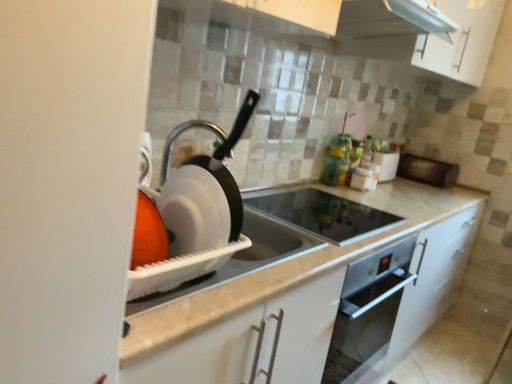
How much space does white plastic dish rack at left, which appears as the 1th appliance when viewed from the left, occupy horizontally?

white plastic dish rack at left, which appears as the 1th appliance when viewed from the left, is 4.08 inches in width.

What is the approximate height of black matte microwave at right, which ranks as the fourth appliance in front-to-back order?

black matte microwave at right, which ranks as the fourth appliance in front-to-back order, is 5.98 inches tall.

How much space does white glossy toaster at upper right, which ranks as the 3th appliance in front-to-back order, occupy horizontally?

It is 5.95 inches.

This screenshot has width=512, height=384. What do you see at coordinates (322, 213) in the screenshot? I see `black glass cooktop at center, the second appliance when ordered from left to right` at bounding box center [322, 213].

Where is `white glossy exhaust hood at upper center`? This screenshot has height=384, width=512. white glossy exhaust hood at upper center is located at coordinates (387, 27).

The height and width of the screenshot is (384, 512). What are the coordinates of `white plastic dish rack at left, which is the 4th appliance from right to left` in the screenshot? It's located at (197, 216).

From the image's perspective, is white glossy toaster at upper right, which ranks as the 3th appliance in front-to-back order, on white plastic dish rack at left, which is the 1th appliance in front-to-back order?

Yes, from the image's perspective, white glossy toaster at upper right, which ranks as the 3th appliance in front-to-back order, is on top of white plastic dish rack at left, which is the 1th appliance in front-to-back order.

Can you confirm if white glossy toaster at upper right, the 3th appliance in the left-to-right sequence, is smaller than white plastic dish rack at left, which appears as the 1th appliance when viewed from the left?

Correct, white glossy toaster at upper right, the 3th appliance in the left-to-right sequence, occupies less space than white plastic dish rack at left, which appears as the 1th appliance when viewed from the left.

Can you tell me how much white glossy toaster at upper right, the second appliance when ordered from right to left, and white plastic dish rack at left, the fourth appliance when ordered from back to front, differ in facing direction?

white glossy toaster at upper right, the second appliance when ordered from right to left, and white plastic dish rack at left, the fourth appliance when ordered from back to front, are facing 95.2 degrees away from each other.

From the image's perspective, would you say white marble countertop at center is positioned over black matte microwave at right, placed as the 4th appliance when sorted from left to right?

No.

From a real-world perspective, is white marble countertop at center on top of black matte microwave at right, positioned as the 1th appliance in right-to-left order?

No.

Based on their sizes in the image, would you say white marble countertop at center is bigger or smaller than black matte microwave at right, which ranks as the fourth appliance in front-to-back order?

white marble countertop at center is bigger than black matte microwave at right, which ranks as the fourth appliance in front-to-back order.

Looking at this image, can you confirm if white marble countertop at center is taller than black matte microwave at right, which ranks as the fourth appliance in front-to-back order?

Correct, white marble countertop at center is much taller as black matte microwave at right, which ranks as the fourth appliance in front-to-back order.

What's the angular difference between black matte microwave at right, positioned as the 1th appliance in right-to-left order, and white marble countertop at center's facing directions?

90.9 degrees.

Does point (448, 167) come farther from viewer compared to point (311, 278)?

Yes.

Is white marble countertop at center at the back of black matte microwave at right, which ranks as the fourth appliance in front-to-back order?

That's not correct — black matte microwave at right, which ranks as the fourth appliance in front-to-back order, is not looking away from white marble countertop at center.

Relative to white marble countertop at center, is black matte microwave at right, the 1th appliance from the back, in front or behind?

black matte microwave at right, the 1th appliance from the back, is positioned farther from the viewer than white marble countertop at center.

Between white marble countertop at center and white glossy toaster at upper right, the 2th appliance viewed from the back, which one has more height?

white marble countertop at center.

Based on their positions, is white marble countertop at center located to the left or right of white glossy toaster at upper right, which ranks as the 3th appliance in front-to-back order?

Based on their positions, white marble countertop at center is located to the left of white glossy toaster at upper right, which ranks as the 3th appliance in front-to-back order.

Which point is more forward, (302,361) or (387,170)?

Positioned in front is point (302,361).

Looking at this image, can you confirm if white marble countertop at center is wider than white glossy toaster at upper right, the 3th appliance in the left-to-right sequence?

Indeed, white marble countertop at center has a greater width compared to white glossy toaster at upper right, the 3th appliance in the left-to-right sequence.

Are white glossy toaster at upper right, the second appliance when ordered from right to left, and black matte microwave at right, which ranks as the fourth appliance in front-to-back order, making contact?

No, white glossy toaster at upper right, the second appliance when ordered from right to left, is not next to black matte microwave at right, which ranks as the fourth appliance in front-to-back order.

Based on the photo, could you measure the distance between white glossy toaster at upper right, the 2th appliance viewed from the back, and black matte microwave at right, which ranks as the fourth appliance in front-to-back order?

13.44 inches.

Which is behind, point (376, 154) or point (416, 164)?

Point (416, 164)

In the scene shown: From the image's perspective, which is below, white glossy toaster at upper right, the 2th appliance viewed from the back, or black matte microwave at right, the 1th appliance from the back?

From the image's view, black matte microwave at right, the 1th appliance from the back, is below.

Considering the sizes of objects black glass cooktop at center, which appears as the 3th appliance when viewed from the back, and white marble countertop at center in the image provided, who is taller, black glass cooktop at center, which appears as the 3th appliance when viewed from the back, or white marble countertop at center?

With more height is white marble countertop at center.

Would you say black glass cooktop at center, the second appliance from the front, is to the left or to the right of white marble countertop at center in the picture?

black glass cooktop at center, the second appliance from the front, is positioned on white marble countertop at center's left side.

From a real-world perspective, is black glass cooktop at center, the second appliance from the front, above or below white marble countertop at center?

From a real-world perspective, black glass cooktop at center, the second appliance from the front, is physically above white marble countertop at center.

Is black glass cooktop at center, the second appliance from the front, turned away from white marble countertop at center?

Correct, black glass cooktop at center, the second appliance from the front, is looking away from white marble countertop at center.

Is white plastic dish rack at left, which is the 4th appliance from right to left, at the back of black matte microwave at right, which ranks as the fourth appliance in front-to-back order?

No, black matte microwave at right, which ranks as the fourth appliance in front-to-back order, is not facing the opposite direction of white plastic dish rack at left, which is the 4th appliance from right to left.

This screenshot has height=384, width=512. There is a black matte microwave at right, placed as the 4th appliance when sorted from left to right. What are the coordinates of `the 2nd appliance above it (from a real-world perspective)` in the screenshot? It's located at (197, 216).

What's the angular difference between black matte microwave at right, positioned as the 1th appliance in right-to-left order, and white plastic dish rack at left, the fourth appliance when ordered from back to front,'s facing directions?

The angular difference between black matte microwave at right, positioned as the 1th appliance in right-to-left order, and white plastic dish rack at left, the fourth appliance when ordered from back to front, is 175 degrees.

Starting from the white plastic dish rack at left, which is the 4th appliance from right to left, which appliance is the 2nd one to the right? Please provide its 2D coordinates.

[(386, 164)]

Find the location of a particular element. the 4th appliance behind when counting from the white marble countertop at center is located at coordinates (426, 170).

Considering their positions, is black matte microwave at right, the 1th appliance from the back, positioned further to white marble countertop at center than black glass cooktop at center, which appears as the 3th appliance when viewed from the back?

black matte microwave at right, the 1th appliance from the back, is positioned further to the anchor white marble countertop at center.

Based on the photo, looking at the image, which one is located closer to white glossy exhaust hood at upper center, white marble countertop at center or white plastic dish rack at left, which is the 4th appliance from right to left?

white plastic dish rack at left, which is the 4th appliance from right to left.

In the scene shown: Estimate the real-world distances between objects in this image. Which object is closer to white glossy toaster at upper right, the second appliance when ordered from right to left, black glass cooktop at center, acting as the third appliance starting from the right, or white marble countertop at center?

black glass cooktop at center, acting as the third appliance starting from the right, is closer to white glossy toaster at upper right, the second appliance when ordered from right to left.

Looking at the image, which one is located closer to black matte microwave at right, the 1th appliance from the back, white plastic dish rack at left, the fourth appliance when ordered from back to front, or white glossy toaster at upper right, the second appliance when ordered from right to left?

white glossy toaster at upper right, the second appliance when ordered from right to left, lies closer to black matte microwave at right, the 1th appliance from the back, than the other object.

When comparing their distances from white marble countertop at center, does black glass cooktop at center, which appears as the 3th appliance when viewed from the back, or black matte microwave at right, positioned as the 1th appliance in right-to-left order, seem closer?

black glass cooktop at center, which appears as the 3th appliance when viewed from the back.

Looking at the image, which one is located closer to white marble countertop at center, white glossy toaster at upper right, which ranks as the 3th appliance in front-to-back order, or black glass cooktop at center, the second appliance from the front?

The object closer to white marble countertop at center is black glass cooktop at center, the second appliance from the front.

Estimate the real-world distances between objects in this image. Which object is closer to black matte microwave at right, the 1th appliance from the back, white glossy toaster at upper right, the second appliance when ordered from right to left, or white plastic dish rack at left, which is the 4th appliance from right to left?

Based on the image, white glossy toaster at upper right, the second appliance when ordered from right to left, appears to be nearer to black matte microwave at right, the 1th appliance from the back.

Consider the image. Which object lies nearer to the anchor point black glass cooktop at center, the second appliance when ordered from left to right, white glossy toaster at upper right, the 2th appliance viewed from the back, or black matte microwave at right, which ranks as the fourth appliance in front-to-back order?

Among the two, white glossy toaster at upper right, the 2th appliance viewed from the back, is located nearer to black glass cooktop at center, the second appliance when ordered from left to right.

The width and height of the screenshot is (512, 384). Find the location of `exhaust hood between white plastic dish rack at left, which appears as the 1th appliance when viewed from the left, and white glossy toaster at upper right, which ranks as the 3th appliance in front-to-back order, in the front-back direction`. exhaust hood between white plastic dish rack at left, which appears as the 1th appliance when viewed from the left, and white glossy toaster at upper right, which ranks as the 3th appliance in front-to-back order, in the front-back direction is located at coordinates (387, 27).

Identify the location of appliance between white plastic dish rack at left, which appears as the 1th appliance when viewed from the left, and white glossy toaster at upper right, the 2th appliance viewed from the back, from front to back. [322, 213].

Identify the location of appliance between white marble countertop at center and black glass cooktop at center, which appears as the 3th appliance when viewed from the back, in the front-back direction. (197, 216).

Where is `exhaust hood located between white marble countertop at center and white glossy toaster at upper right, which ranks as the 3th appliance in front-to-back order, in the depth direction`? The image size is (512, 384). exhaust hood located between white marble countertop at center and white glossy toaster at upper right, which ranks as the 3th appliance in front-to-back order, in the depth direction is located at coordinates (387, 27).